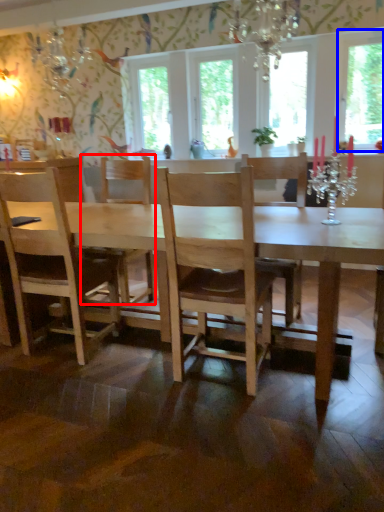
Question: Which object is further to the camera taking this photo, chair (highlighted by a red box) or window screen (highlighted by a blue box)?

Choices:
 (A) chair
 (B) window screen

Answer: (B)